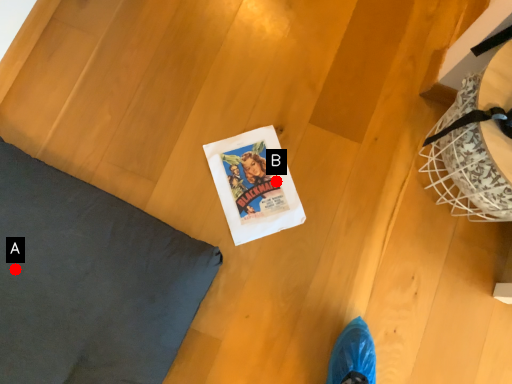
Question: Two points are circled on the image, labeled by A and B beside each circle. Which of the following is the closest to the observer?

Choices:
 (A) A is closer
 (B) B is closer

Answer: (A)